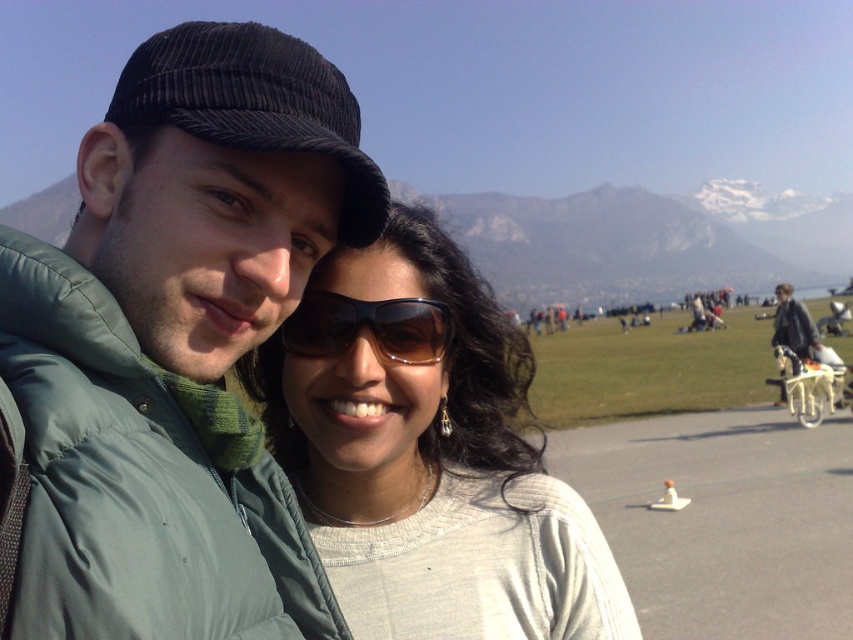
Question: Can you confirm if matte white sweater at center is smaller than brown matte sunglasses at center?

Choices:
 (A) no
 (B) yes

Answer: (B)

Question: Among these objects, which one is nearest to the camera?

Choices:
 (A) brown matte sunglasses at center
 (B) green puffy jacket at center

Answer: (B)

Question: Can you confirm if green puffy jacket at center is smaller than brown matte sunglasses at center?

Choices:
 (A) no
 (B) yes

Answer: (A)

Question: Which object is closer to the camera taking this photo?

Choices:
 (A) matte white sweater at center
 (B) brown matte sunglasses at center

Answer: (B)

Question: Can you confirm if green puffy jacket at center is thinner than matte white sweater at center?

Choices:
 (A) yes
 (B) no

Answer: (B)

Question: Which of the following is the farthest from the observer?

Choices:
 (A) [426, 321]
 (B) [148, 474]

Answer: (A)